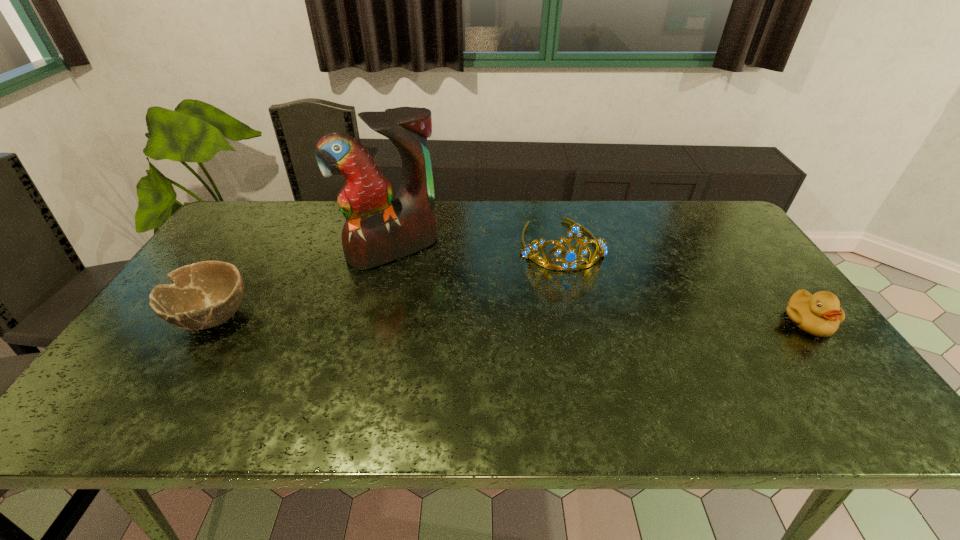
This screenshot has width=960, height=540. I want to click on vacant space that's between the tiara and the leftmost object, so (x=387, y=281).

In order to click on free point between the rightmost object and the tiara in this screenshot , I will do `click(684, 283)`.

The width and height of the screenshot is (960, 540). Identify the location of vacant space in between the leftmost object and the tiara. (387, 281).

Point out which object is positioned as the nearest to the second tallest object. Please provide its 2D coordinates. Your answer should be formatted as a tuple, i.e. [(x, y)], where the tuple contains the x and y coordinates of a point satisfying the conditions above.

[(378, 229)]

The height and width of the screenshot is (540, 960). What are the coordinates of `object that stands as the third closest to the duckling` in the screenshot? It's located at (202, 295).

Image resolution: width=960 pixels, height=540 pixels. Identify the location of blank space that satisfies the following two spatial constraints: 1. on the back side of the third object from left to right; 2. on the left side of the bowl. (258, 245).

Identify the location of vacant space that satisfies the following two spatial constraints: 1. on the back side of the second object from left to right; 2. on the right side of the tiara. The height and width of the screenshot is (540, 960). (395, 245).